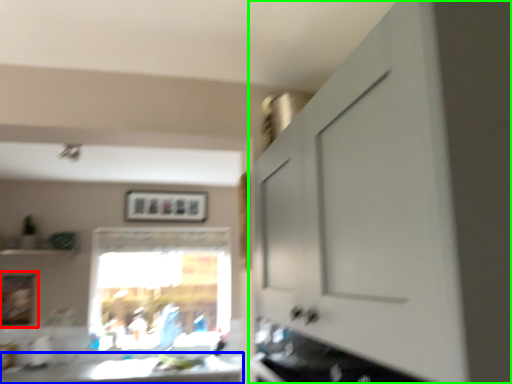
Question: Estimate the real-world distances between objects in this image. Which object is closer to picture frame (highlighted by a red box), counter top (highlighted by a blue box) or cabinetry (highlighted by a green box)?

Choices:
 (A) counter top
 (B) cabinetry

Answer: (A)